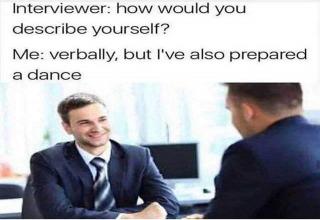
You are a GUI agent. You are given a task and a screenshot of the screen. Output one action in this format:
    pyautogui.click(x=<x>, y=<y>)
    Task: Click on the computer mouse
    Image resolution: width=320 pixels, height=220 pixels.
    Given the screenshot: What is the action you would take?
    pyautogui.click(x=205, y=191)